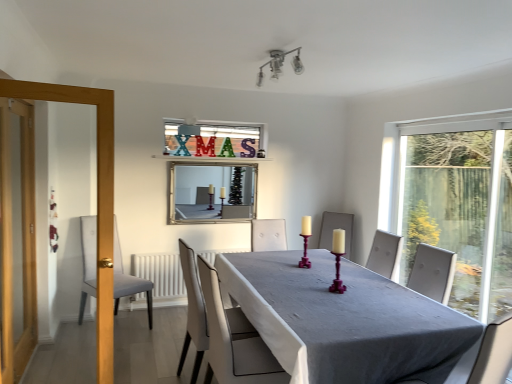
In order to click on free space above metallic glass light fixture at upper center (from a real-world perspective) in this screenshot , I will do `click(281, 49)`.